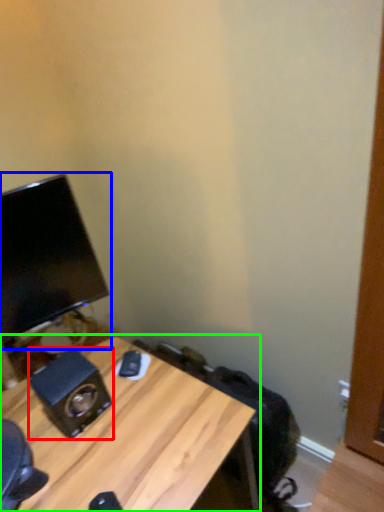
Question: Based on their relative distances, which object is farther from speaker (highlighted by a red box)? Choose from computer monitor (highlighted by a blue box) and desk (highlighted by a green box).

Choices:
 (A) computer monitor
 (B) desk

Answer: (A)